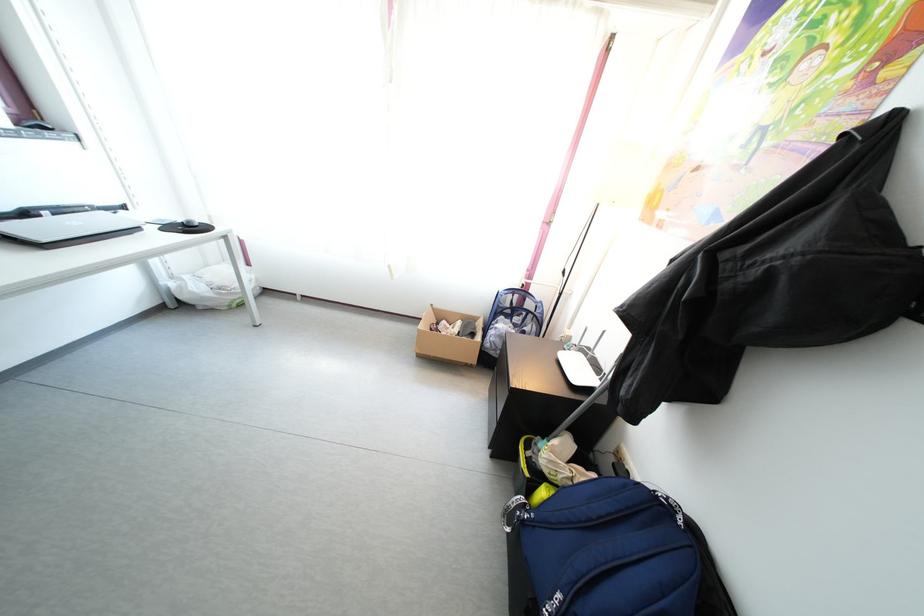
Where is `blue backpack`? The width and height of the screenshot is (924, 616). blue backpack is located at coordinates (613, 554).